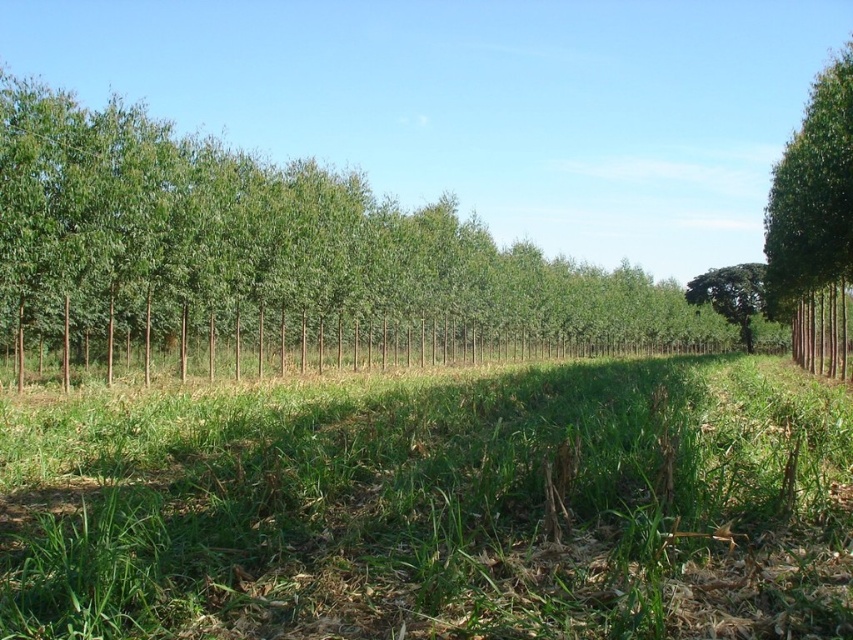
Is green grass at center taller than green leafy tree at right?

No, green grass at center is not taller than green leafy tree at right.

Is point (53, 620) closer to camera compared to point (779, 192)?

Yes.

You are a GUI agent. You are given a task and a screenshot of the screen. Output one action in this format:
    pyautogui.click(x=<x>, y=<y>)
    Task: Click on the green grass at center
    The image size is (853, 640).
    Given the screenshot: What is the action you would take?
    pyautogui.click(x=437, y=508)

Is green leafy tree at center closer to the viewer compared to green leafy tree at center-right?

Yes, it is.

Is point (460, 224) positioned in front of point (758, 273)?

Yes, it is.

Where is `green leafy tree at center`? The height and width of the screenshot is (640, 853). green leafy tree at center is located at coordinates (277, 252).

Identify the location of green leafy tree at center. (277, 252).

Can you confirm if green leafy tree at center is bigger than green leafy tree at right?

Incorrect, green leafy tree at center is not larger than green leafy tree at right.

Who is more forward, (466, 348) or (773, 166)?

Point (466, 348) is more forward.

Is point (474, 310) farther from camera compared to point (809, 120)?

Yes, it is behind point (809, 120).

Locate an element on the screen. green leafy tree at center is located at coordinates (277, 252).